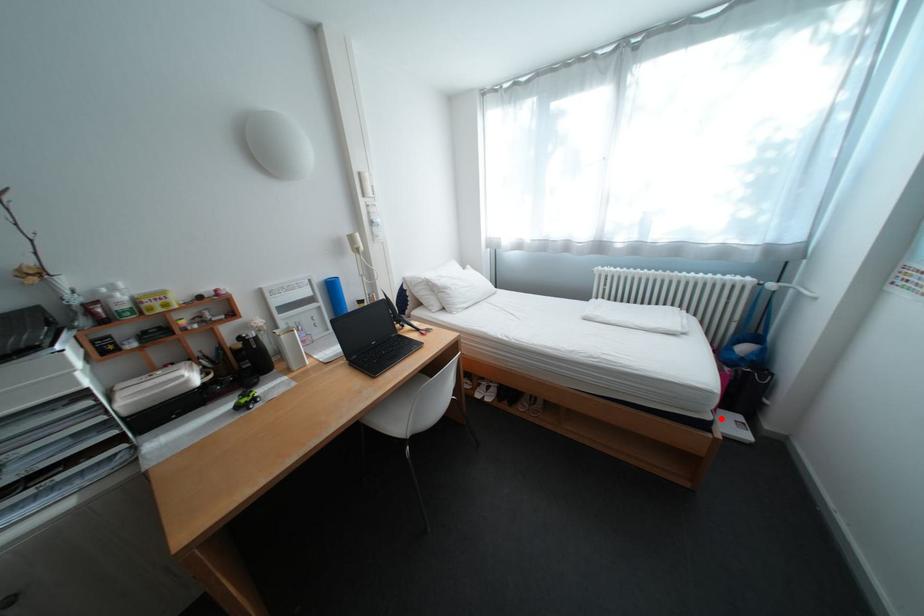
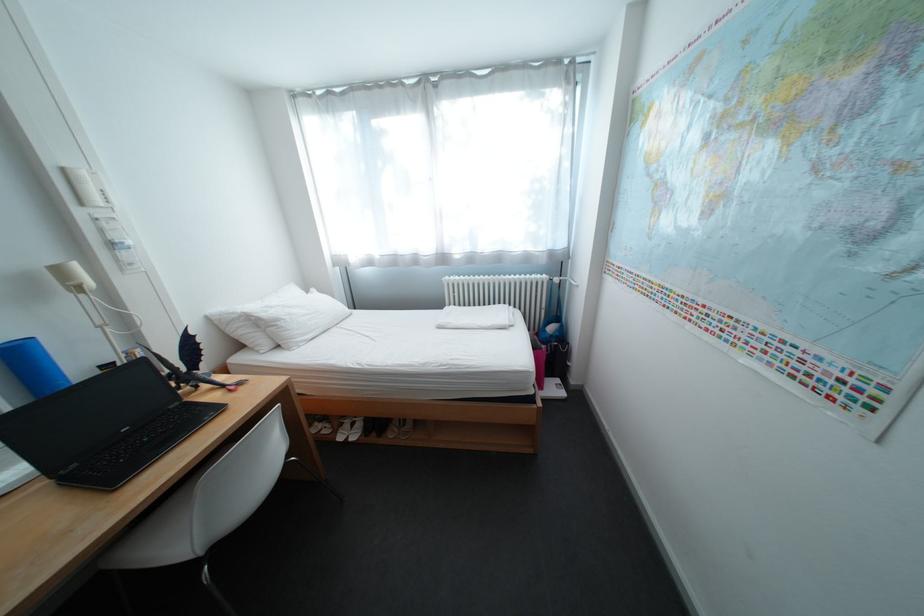
Where in the second image is the point corresponding to the highlighted location from the first image?

(544, 392)